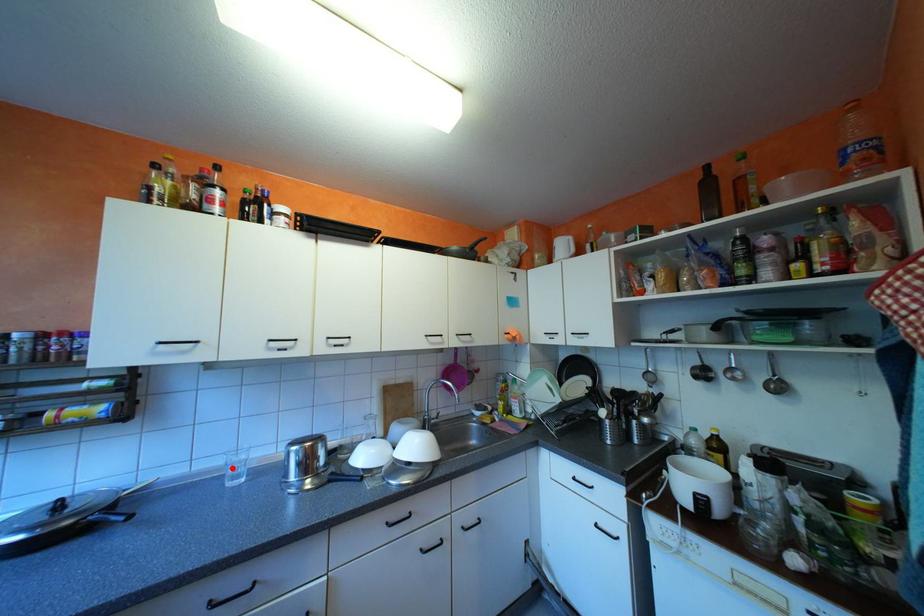
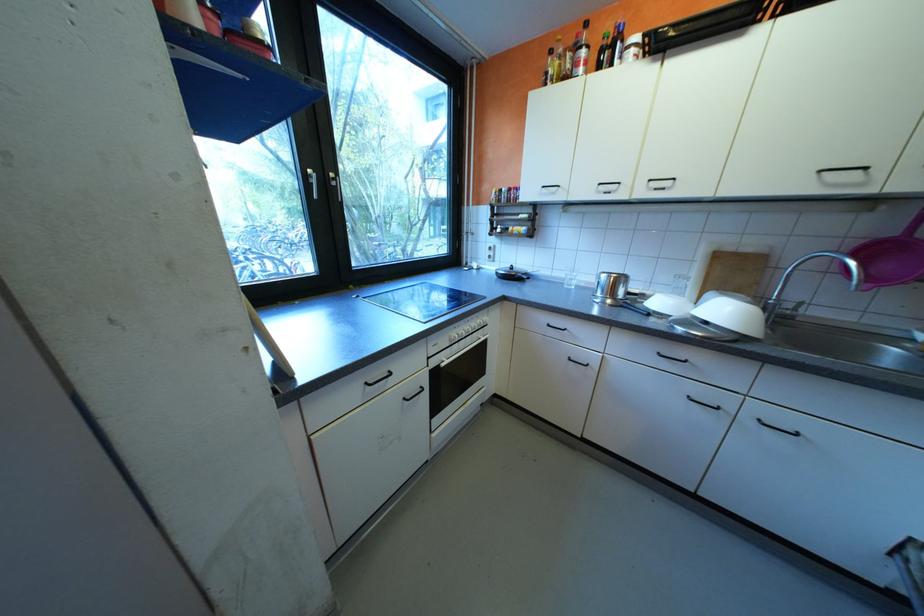
Find the pixel in the second image that matches the highlighted location in the first image.

(576, 278)